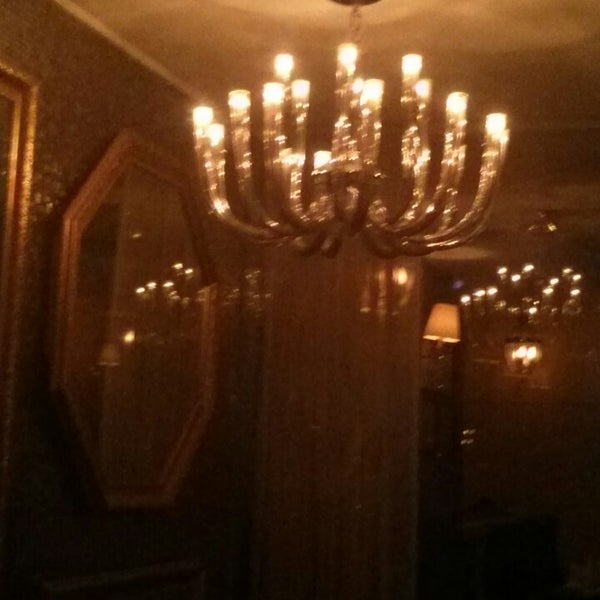
Image resolution: width=600 pixels, height=600 pixels. Identify the location of top edge of mirror. (158, 153).